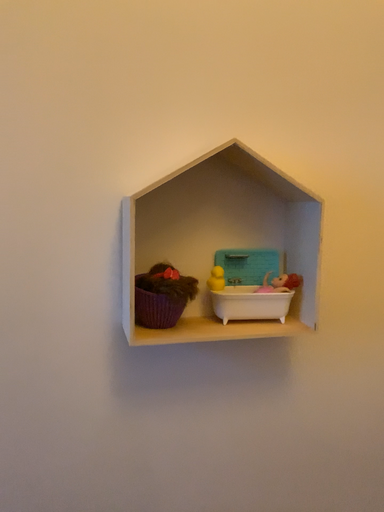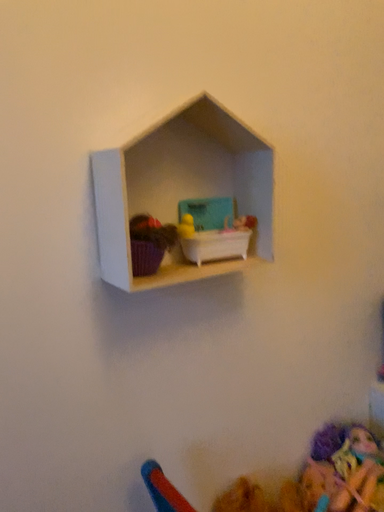
Question: Which way did the camera rotate in the video?

Choices:
 (A) rotated right
 (B) rotated left

Answer: (A)